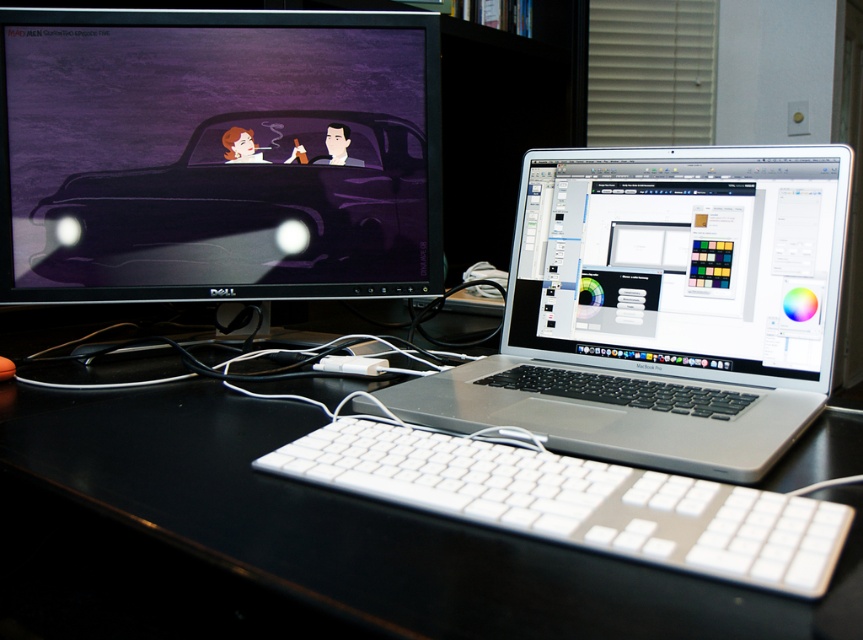
You are setting up a new monitor that requires 1.5 meters of vertical clearance. Based on the scene, will the black glossy computer desk at center provide enough space for the monitor above the satin silver laptop at center?

The black glossy computer desk at center is much taller than the satin silver laptop at center, so there should be sufficient vertical clearance to accommodate the monitor requiring 1.5 meters of space above the laptop.

You are setting up a new webcam for a video call and need to position it directly above the matte black monitor at upper left. According to the coordinates provided, where should you place the webcam to ensure it is centered over the monitor?

The matte black monitor at upper left is located at point (217, 154), so you should place the webcam directly above these coordinates to center it over the monitor.